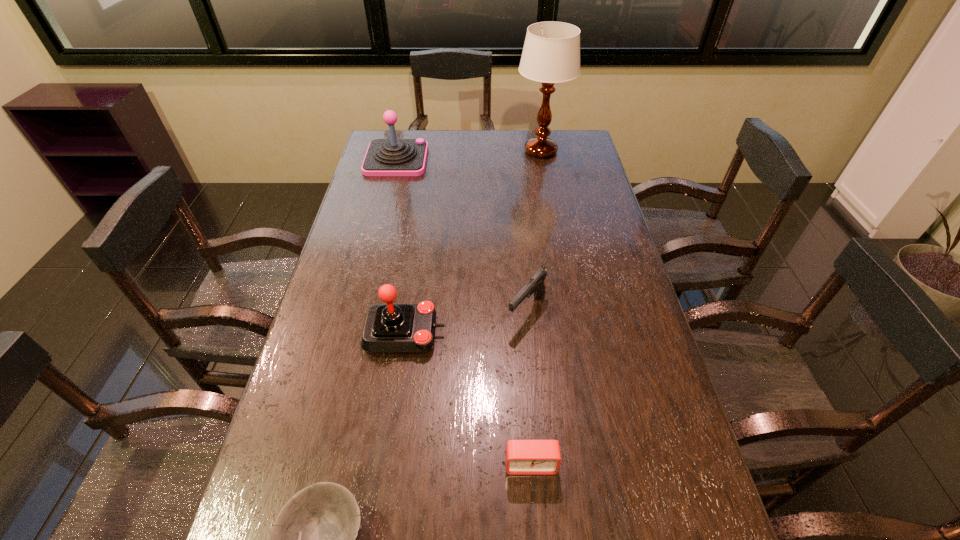
You are a GUI agent. You are given a task and a screenshot of the screen. Output one action in this format:
    pyautogui.click(x=<x>, y=<y>)
    Task: Click on the tallest object
    
    Given the screenshot: What is the action you would take?
    pyautogui.click(x=551, y=54)

Identify the location of the farther joystick. This screenshot has height=540, width=960. (x=385, y=157).

Where is `the nearer joystick`? Image resolution: width=960 pixels, height=540 pixels. the nearer joystick is located at coordinates (389, 328).

Find the location of `the third shortest object`. the third shortest object is located at coordinates (535, 285).

This screenshot has width=960, height=540. I want to click on the fifth farthest object, so click(523, 457).

Where is `vacant position located on the left of the tallest object`? This screenshot has width=960, height=540. vacant position located on the left of the tallest object is located at coordinates (477, 151).

Locate an element on the screen. free space located 0.390m forward from the base of the farther joystick is located at coordinates (524, 160).

Where is `free space located 0.130m on the base of the nearer joystick`? Image resolution: width=960 pixels, height=540 pixels. free space located 0.130m on the base of the nearer joystick is located at coordinates (493, 333).

In order to click on free spot located 0.180m at the muzzle of the fourth tallest object in this screenshot , I will do `click(535, 394)`.

You are a GUI agent. You are given a task and a screenshot of the screen. Output one action in this format:
    pyautogui.click(x=<x>, y=<y>)
    Task: Click on the vacant space located on the front-facing side of the second nearest object
    
    Given the screenshot: What is the action you would take?
    pyautogui.click(x=534, y=502)